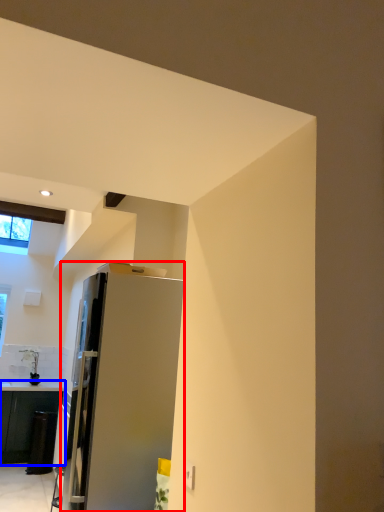
Question: Which point is closer to the camera, refrigerator (highlighted by a red box) or cabinetry (highlighted by a blue box)?

Choices:
 (A) refrigerator
 (B) cabinetry

Answer: (A)